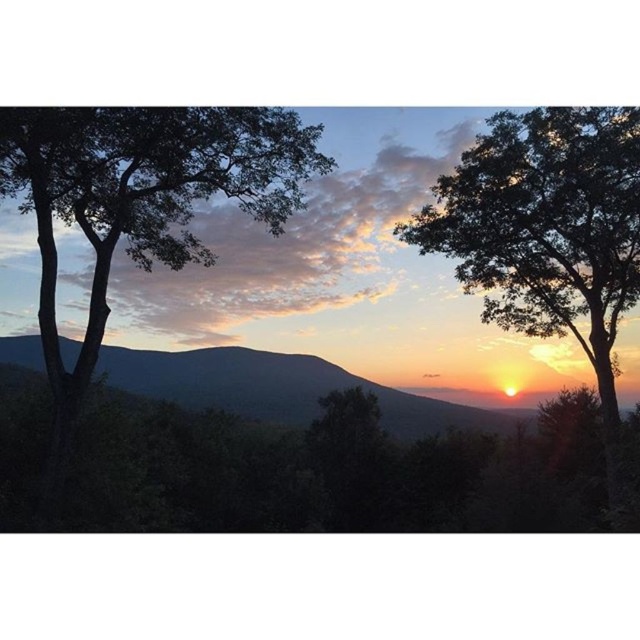
You are an artist trying to paint the sunset scene. You want to place a bird in the image such that it is positioned exactly halfway between the green leafy tree at right and the center of the image. What are the coordinates of the point where you should place the bird?

The green leafy tree at right is located at coordinates (545, 227). The center of the image is at coordinates (320, 320). To find the midpoint between these two points, calculate the average of the x and y coordinates separately. The midpoint x is 0.355 plus 0.5 divided by 2 equals 0.4275, and the midpoint y is 0.853 plus 0.5 divided by 2 equals 0.6765. Therefore, the bird should be placed at coordinates approximately (433, 273).

You are standing in the middle of the path between the green leafy tree at left and the green leafy tree at right. Which tree is closer to you?

The green leafy tree at left is closer to you because it is in front of the green leafy tree at right.